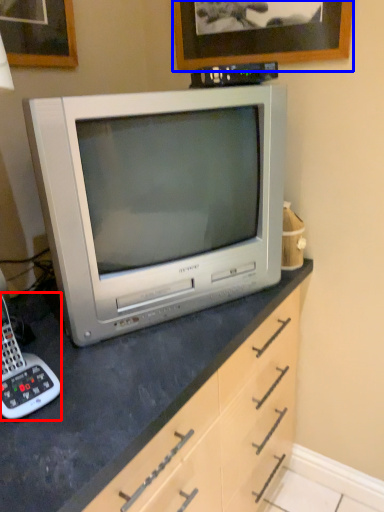
Question: Among these objects, which one is nearest to the camera, corded phone (highlighted by a red box) or picture frame (highlighted by a blue box)?

Choices:
 (A) corded phone
 (B) picture frame

Answer: (A)